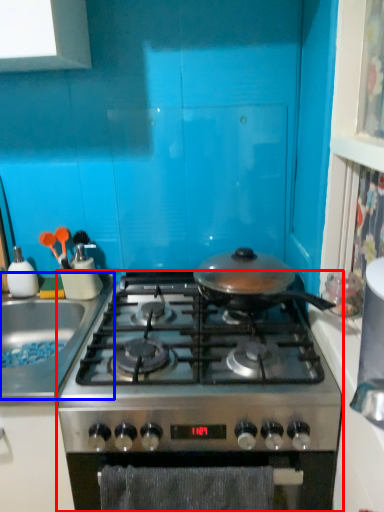
Question: Which object is further to the camera taking this photo, gas stove (highlighted by a red box) or sink (highlighted by a blue box)?

Choices:
 (A) gas stove
 (B) sink

Answer: (B)